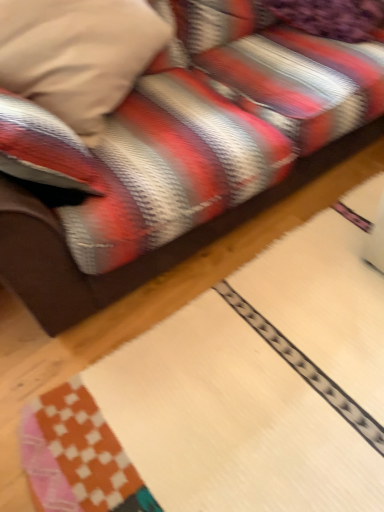
Question: Is velvet purple pillow at upper right, positioned as the first pillow in right-to-left order, closer to the viewer compared to velvety beige pillow at upper left, the first pillow positioned from the left?

Choices:
 (A) no
 (B) yes

Answer: (A)

Question: Can you confirm if velvet purple pillow at upper right, which is the second pillow from left to right, is shorter than velvety beige pillow at upper left, the first pillow positioned from the left?

Choices:
 (A) no
 (B) yes

Answer: (B)

Question: Does velvet purple pillow at upper right, which is the second pillow from left to right, have a greater width compared to velvety beige pillow at upper left, which appears as the second pillow when viewed from the right?

Choices:
 (A) no
 (B) yes

Answer: (A)

Question: Is velvet purple pillow at upper right, positioned as the first pillow in right-to-left order, in contact with velvety beige pillow at upper left, the first pillow positioned from the left?

Choices:
 (A) yes
 (B) no

Answer: (B)

Question: Would you say velvet purple pillow at upper right, which is the second pillow from left to right, contains velvety beige pillow at upper left, which appears as the second pillow when viewed from the right?

Choices:
 (A) yes
 (B) no

Answer: (B)

Question: Can you confirm if velvet purple pillow at upper right, positioned as the first pillow in right-to-left order, is taller than velvety beige pillow at upper left, the first pillow positioned from the left?

Choices:
 (A) yes
 (B) no

Answer: (B)

Question: Is velvety beige pillow at upper left, which appears as the second pillow when viewed from the right, positioned far away from velvet purple pillow at upper right, which is the second pillow from left to right?

Choices:
 (A) yes
 (B) no

Answer: (B)

Question: From the image's perspective, is velvety beige pillow at upper left, which appears as the second pillow when viewed from the right, on top of velvet purple pillow at upper right, positioned as the first pillow in right-to-left order?

Choices:
 (A) no
 (B) yes

Answer: (A)

Question: Is velvety beige pillow at upper left, the first pillow positioned from the left, positioned with its back to velvet purple pillow at upper right, which is the second pillow from left to right?

Choices:
 (A) no
 (B) yes

Answer: (A)

Question: Is velvety beige pillow at upper left, which appears as the second pillow when viewed from the right, smaller than velvet purple pillow at upper right, positioned as the first pillow in right-to-left order?

Choices:
 (A) no
 (B) yes

Answer: (A)

Question: Is velvet purple pillow at upper right, which is the second pillow from left to right, completely or partially inside velvety beige pillow at upper left, the first pillow positioned from the left?

Choices:
 (A) yes
 (B) no

Answer: (B)

Question: Considering the relative sizes of velvety beige pillow at upper left, the first pillow positioned from the left, and velvet purple pillow at upper right, which is the second pillow from left to right, in the image provided, is velvety beige pillow at upper left, the first pillow positioned from the left, thinner than velvet purple pillow at upper right, which is the second pillow from left to right,?

Choices:
 (A) no
 (B) yes

Answer: (A)

Question: From a real-world perspective, is velvet purple pillow at upper right, positioned as the first pillow in right-to-left order, above or below velvety beige pillow at upper left, which appears as the second pillow when viewed from the right?

Choices:
 (A) above
 (B) below

Answer: (B)